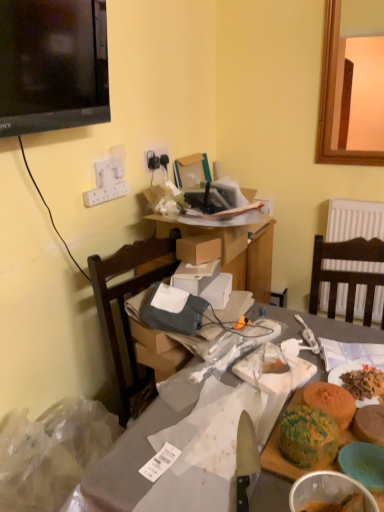
The height and width of the screenshot is (512, 384). What are the coordinates of `free space behind shiny silver knife at center` in the screenshot? It's located at (212, 416).